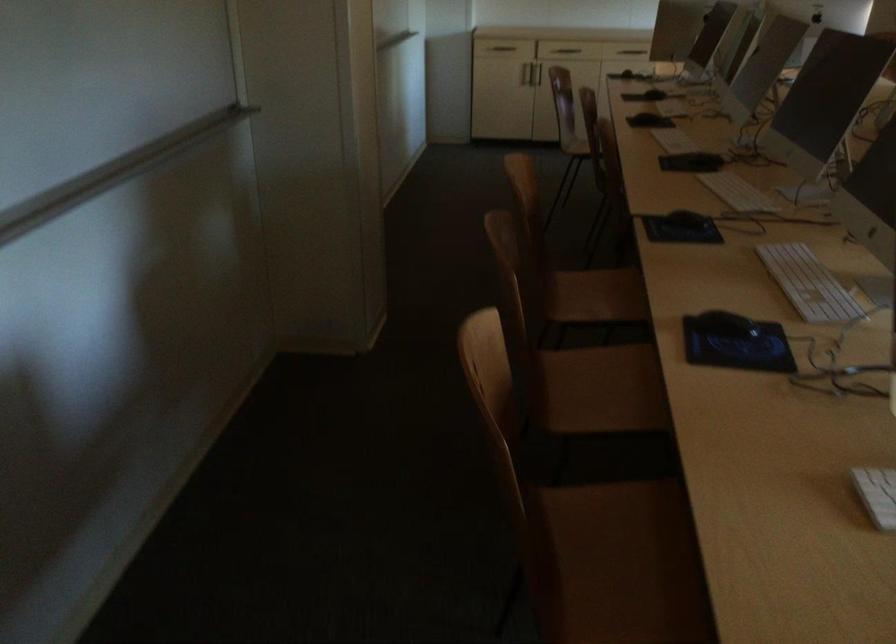
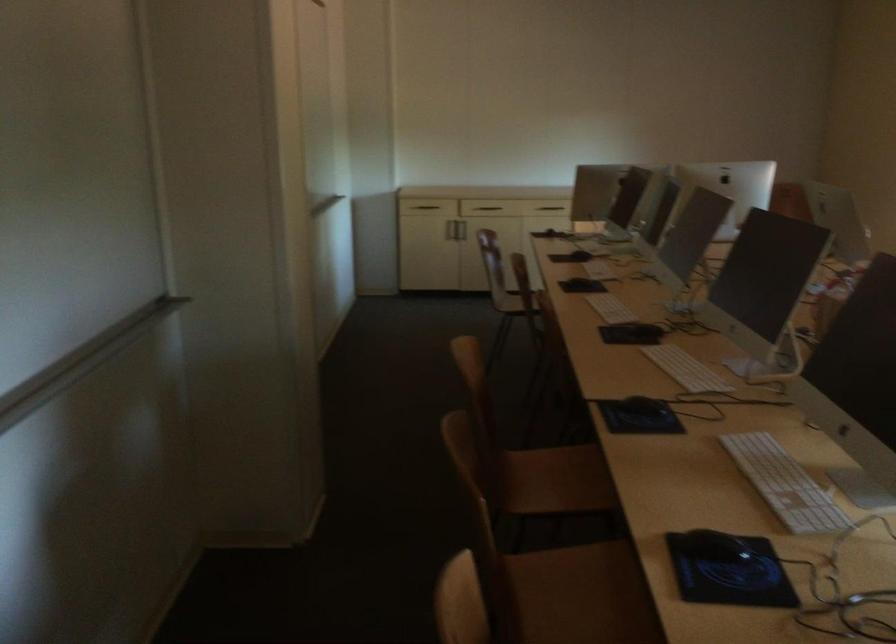
In the second image, find the point that corresponds to pixel 609 383 in the first image.

(581, 594)